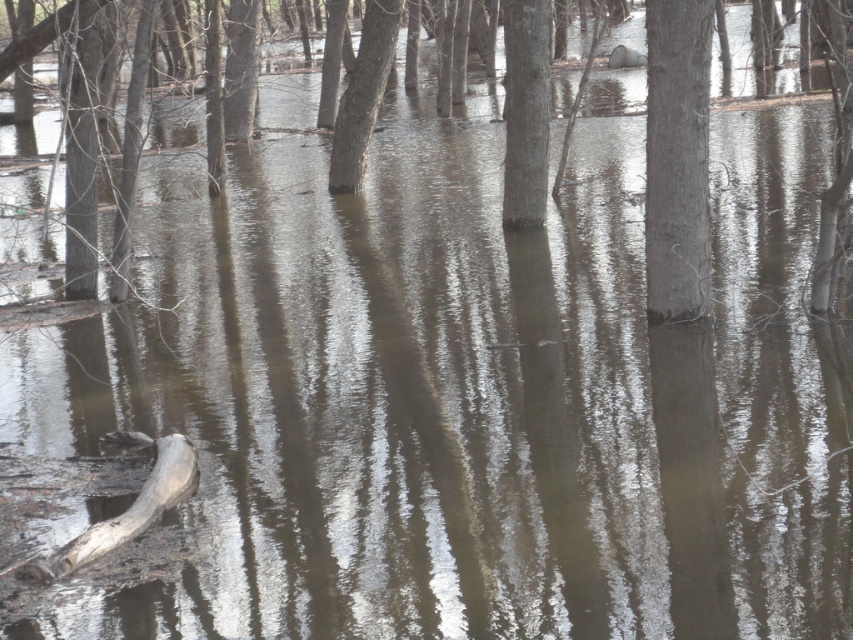
Is point (408, 49) more distant than point (107, 525)?

Yes.

Who is taller, brown matte tree at center or gray wood log at lower left?

brown matte tree at center

The height and width of the screenshot is (640, 853). Find the location of `brown matte tree at center`. brown matte tree at center is located at coordinates (579, 92).

Is smooth gray tree trunk at center positioned in front of brown matte tree at center?

No, smooth gray tree trunk at center is further to the viewer.

Measure the distance between smooth gray tree trunk at center and camera.

They are 11.84 meters apart.

Find the location of a particular element. The height and width of the screenshot is (640, 853). smooth gray tree trunk at center is located at coordinates (677, 157).

Who is taller, smooth gray tree trunk at center or gray wood log at lower left?

smooth gray tree trunk at center

Is smooth gray tree trunk at center smaller than gray wood log at lower left?

Yes.

Between point (666, 92) and point (161, 467), which one is positioned behind?

The point (666, 92) is behind.

Locate an element on the screen. smooth gray tree trunk at center is located at coordinates (677, 157).